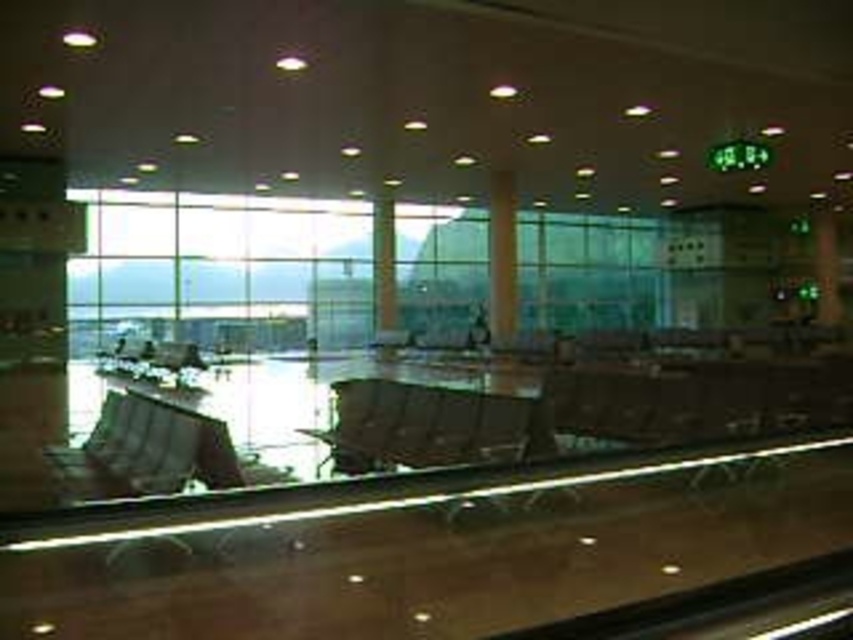
Question: Does brown wood pillar at center appear on the right side of green glass pillar at center?

Choices:
 (A) yes
 (B) no

Answer: (A)

Question: Observing the image, what is the correct spatial positioning of brown wood pillar at center in reference to green glass pillar at center?

Choices:
 (A) left
 (B) right

Answer: (B)

Question: Does brown wood pillar at center appear over green glass pillar at center?

Choices:
 (A) yes
 (B) no

Answer: (B)

Question: Which object is farther from the camera taking this photo?

Choices:
 (A) green glass pillar at center
 (B) brown wood pillar at center

Answer: (A)